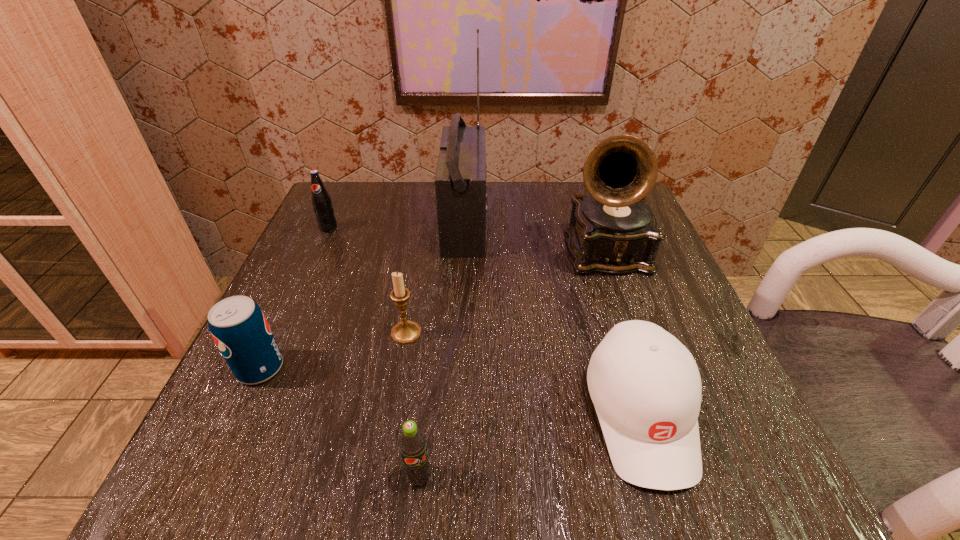
At what (x,y) coordinates should I click in order to perform the action: click on vacant area that satisfies the following two spatial constraints: 1. on the front label of the farthest soda; 2. on the right side of the candle holder. Please return your answer as a coordinate pair (x, y). Looking at the image, I should click on (281, 333).